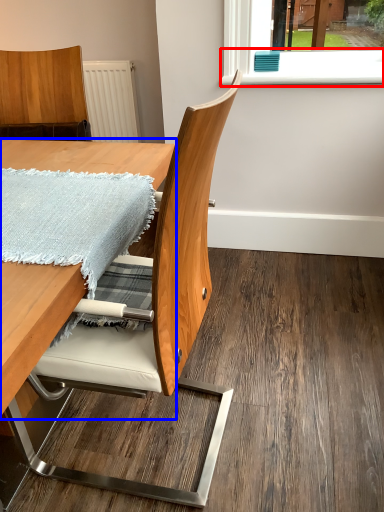
Question: Which object appears closest to the camera in this image, window sill (highlighted by a red box) or table (highlighted by a blue box)?

Choices:
 (A) window sill
 (B) table

Answer: (B)